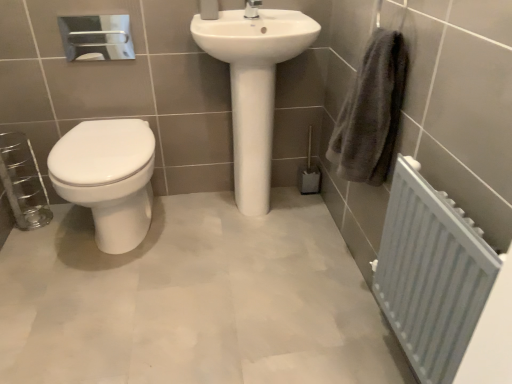
Question: Are white glossy sink at center and white glossy toilet at left making contact?

Choices:
 (A) yes
 (B) no

Answer: (B)

Question: Is white glossy sink at center closer to camera compared to white glossy toilet at left?

Choices:
 (A) yes
 (B) no

Answer: (B)

Question: Can you confirm if white glossy sink at center is wider than white glossy toilet at left?

Choices:
 (A) no
 (B) yes

Answer: (A)

Question: Is white glossy sink at center at the right side of white glossy toilet at left?

Choices:
 (A) yes
 (B) no

Answer: (A)

Question: From a real-world perspective, is white glossy sink at center positioned under white glossy toilet at left based on gravity?

Choices:
 (A) no
 (B) yes

Answer: (A)

Question: Is point (397, 105) positioned closer to the camera than point (254, 102)?

Choices:
 (A) closer
 (B) farther

Answer: (A)

Question: In the image, is gray cotton towel at right positioned in front of or behind white glossy sink at center?

Choices:
 (A) front
 (B) behind

Answer: (A)

Question: In the image, is gray cotton towel at right on the left side or the right side of white glossy sink at center?

Choices:
 (A) right
 (B) left

Answer: (A)

Question: Considering the positions of gray cotton towel at right and white glossy sink at center in the image, is gray cotton towel at right wider or thinner than white glossy sink at center?

Choices:
 (A) thin
 (B) wide

Answer: (A)

Question: From the image's perspective, is gray cotton towel at right above or below polished chrome tap at upper center?

Choices:
 (A) above
 (B) below

Answer: (B)

Question: Based on their positions, is gray cotton towel at right located to the left or right of polished chrome tap at upper center?

Choices:
 (A) right
 (B) left

Answer: (A)

Question: From a real-world perspective, relative to polished chrome tap at upper center, is gray cotton towel at right vertically above or below?

Choices:
 (A) below
 (B) above

Answer: (A)

Question: Looking at their shapes, would you say gray cotton towel at right is wider or thinner than polished chrome tap at upper center?

Choices:
 (A) wide
 (B) thin

Answer: (A)

Question: In the image, is white glossy toilet at left positioned in front of or behind polished chrome tap at upper center?

Choices:
 (A) behind
 (B) front

Answer: (B)

Question: From the image's perspective, is white glossy toilet at left located above or below polished chrome tap at upper center?

Choices:
 (A) above
 (B) below

Answer: (B)